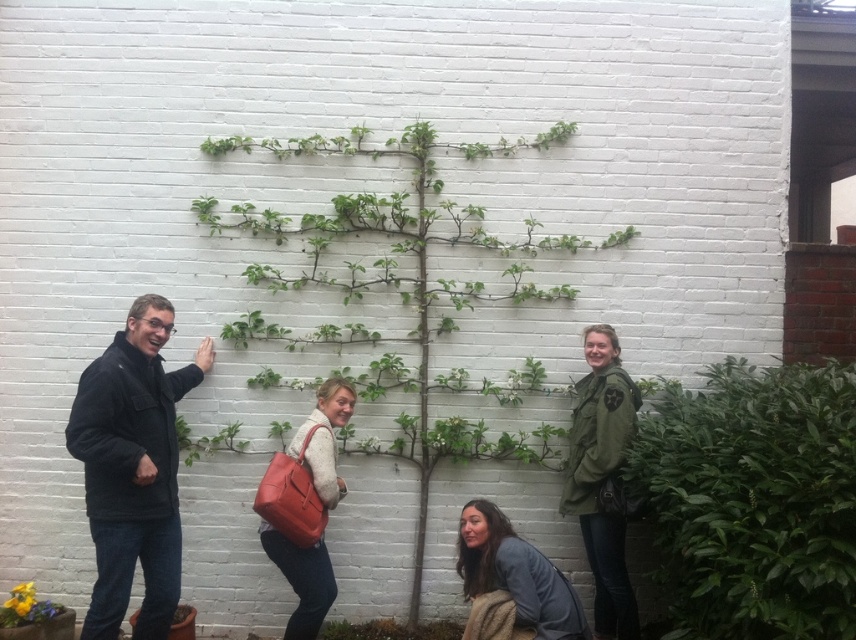
Does green leafy plant at center come behind yellow flower pot at lower left?

Yes, green leafy plant at center is behind yellow flower pot at lower left.

Which is in front, point (280, 241) or point (51, 609)?

Point (51, 609) is more forward.

Locate an element on the screen. This screenshot has width=856, height=640. green leafy plant at center is located at coordinates (403, 289).

Can you confirm if green leafy bush at right is positioned to the left of matte brown leather bag at center?

Incorrect, green leafy bush at right is not on the left side of matte brown leather bag at center.

Is green leafy bush at right thinner than matte brown leather bag at center?

No.

Is point (819, 563) positioned in front of point (278, 531)?

Yes, it is in front of point (278, 531).

At what (x,y) coordinates should I click in order to perform the action: click on green leafy bush at right. Please return your answer as a coordinate pair (x, y). The image size is (856, 640). Looking at the image, I should click on (753, 499).

Who is positioned more to the right, matte brown leather bag at center or gray fabric jacket at lower center?

gray fabric jacket at lower center is more to the right.

Does point (271, 504) come closer to viewer compared to point (506, 600)?

No, it is behind (506, 600).

This screenshot has width=856, height=640. I want to click on matte brown leather bag at center, so click(305, 506).

Find the location of a particular element. The image size is (856, 640). matte brown leather bag at center is located at coordinates (305, 506).